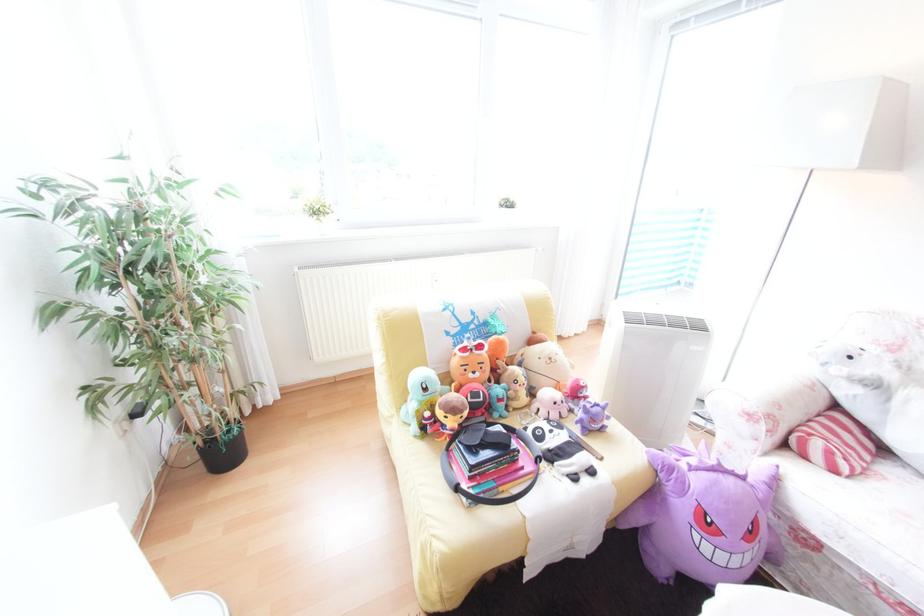
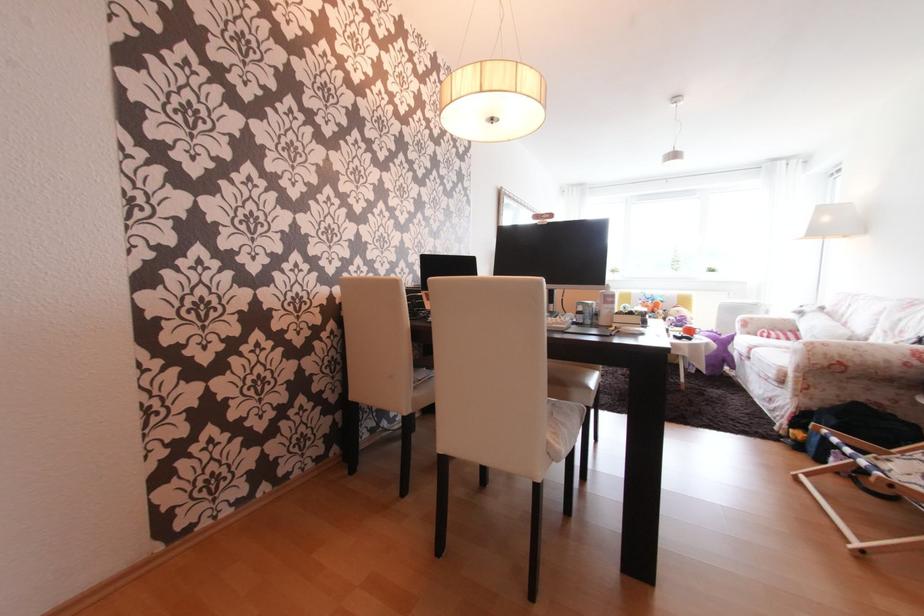
Question: I am providing you with two images of the same scene from different viewpoints. Which of the following objects are not visible in image2?

Choices:
 (A) white chair sitting surface
 (B) pull-up bar handle
 (C) black exercise ring
 (D) black laptop

Answer: (C)